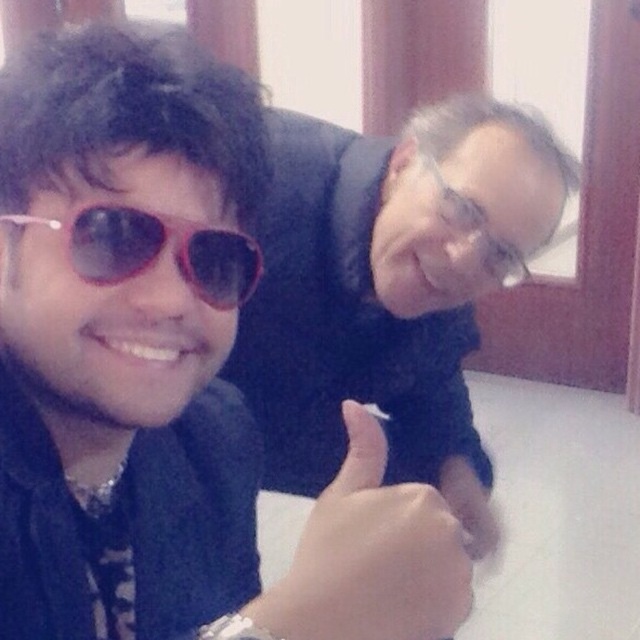
Consider the image. You are standing in a room where two people are sitting. The person on the left is wearing round sunglasses with red frames, and the person on the right has short gray hair and rests their head on the other person. There is a point at coordinates (168, 369). What object is located at that point?

The matte black jacket at upper center is located at point (168, 369).

You are standing in front of the image and want to know where the matte black jacket at upper center is positioned relative to the two people. Can you determine if it is above, below, or at the same level as their heads?

The matte black jacket at upper center is located at point (168, 369), which places it above the heads of the two people since it is positioned higher on the vertical axis.

You are trying to find the pink plastic sunglasses at left in a crowded room. You see the matte black jacket at upper center. Which object is located more to the left?

The pink plastic sunglasses at left is more to the left than the matte black jacket at upper center because the matte black jacket at upper center is positioned on the left side of pink plastic sunglasses at left.